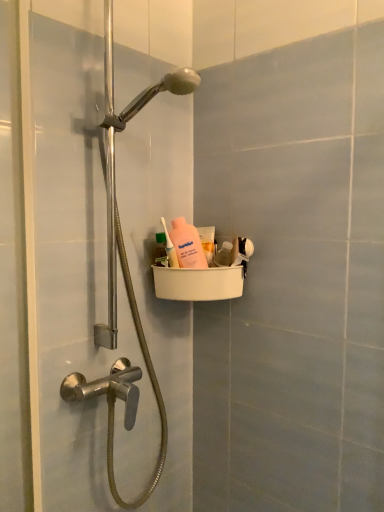
Find the location of a particular element. pink matte bottle at center, the second mouthwash from the left is located at coordinates 207,242.

Identify the location of white plastic basket at upper center. (58, 268).

This screenshot has width=384, height=512. Describe the element at coordinates (170, 248) in the screenshot. I see `pink matte bottle at upper center` at that location.

This screenshot has height=512, width=384. I want to click on pink matte bottle at center, acting as the second mouthwash starting from the front, so click(x=207, y=242).

Can you confirm if green plastic bottle at upper center, the 2th mouthwash in the right-to-left sequence, is positioned to the left of pink matte bottle at upper center?

Indeed, green plastic bottle at upper center, the 2th mouthwash in the right-to-left sequence, is positioned on the left side of pink matte bottle at upper center.

Is green plastic bottle at upper center, which is the 1th mouthwash in front-to-back order, positioned far away from pink matte bottle at upper center?

Actually, green plastic bottle at upper center, which is the 1th mouthwash in front-to-back order, and pink matte bottle at upper center are a little close together.

From the image's perspective, which mouthwash is the 1st one below the pink matte bottle at upper center? Please provide its 2D coordinates.

[(161, 249)]

Which object is closer to the camera taking this photo, green plastic bottle at upper center, the 2th mouthwash in the right-to-left sequence, or pink matte bottle at upper center?

pink matte bottle at upper center is closer to the camera.

Between point (176, 261) and point (133, 195), which one is positioned in front?

Point (133, 195)

Does pink matte bottle at upper center have a lesser height compared to white plastic basket at upper center?

Indeed, pink matte bottle at upper center has a lesser height compared to white plastic basket at upper center.

Is pink matte bottle at upper center aimed at white plastic basket at upper center?

Yes, pink matte bottle at upper center is turned towards white plastic basket at upper center.

Between pink matte bottle at upper center and white plastic basket at upper center, which one has smaller width?

pink matte bottle at upper center.

Considering the relative sizes of green plastic bottle at upper center, which is the 1th mouthwash in front-to-back order, and pink matte bottle at center, which is the first mouthwash in right-to-left order, in the image provided, is green plastic bottle at upper center, which is the 1th mouthwash in front-to-back order, taller than pink matte bottle at center, which is the first mouthwash in right-to-left order,?

No.

From a real-world perspective, who is located lower, green plastic bottle at upper center, which is the 2th mouthwash from back to front, or pink matte bottle at center, the second mouthwash from the left?

From a 3D spatial view, pink matte bottle at center, the second mouthwash from the left, is below.

From the picture: Is green plastic bottle at upper center, which is the 1th mouthwash in front-to-back order, looking in the opposite direction of pink matte bottle at center, which is the first mouthwash in right-to-left order?

No, pink matte bottle at center, which is the first mouthwash in right-to-left order, is not at the back of green plastic bottle at upper center, which is the 1th mouthwash in front-to-back order.

Is green plastic bottle at upper center, acting as the first mouthwash starting from the left, directly adjacent to pink matte bottle at center, the second mouthwash from the left?

There is a gap between green plastic bottle at upper center, acting as the first mouthwash starting from the left, and pink matte bottle at center, the second mouthwash from the left.

Is white plastic basket at upper center aimed at green plastic bottle at upper center, acting as the first mouthwash starting from the left?

Yes, white plastic basket at upper center is aimed at green plastic bottle at upper center, acting as the first mouthwash starting from the left.

Is white plastic basket at upper center shorter than green plastic bottle at upper center, the 2th mouthwash in the right-to-left sequence?

In fact, white plastic basket at upper center may be taller than green plastic bottle at upper center, the 2th mouthwash in the right-to-left sequence.

Measure the distance from white plastic basket at upper center to green plastic bottle at upper center, which is the 2th mouthwash from back to front.

white plastic basket at upper center is 42.00 centimeters from green plastic bottle at upper center, which is the 2th mouthwash from back to front.

Between white plastic basket at upper center and pink matte bottle at upper center, which one appears on the left side from the viewer's perspective?

From the viewer's perspective, white plastic basket at upper center appears more on the left side.

In order to click on screen door below the pink matte bottle at upper center (from the image's perspective) in this screenshot , I will do `click(58, 268)`.

Is white plastic basket at upper center positioned with its back to pink matte bottle at upper center?

Yes, pink matte bottle at upper center is at the back of white plastic basket at upper center.

Considering the relative sizes of pink matte bottle at upper center and green plastic bottle at upper center, which is the 1th mouthwash in front-to-back order, in the image provided, is pink matte bottle at upper center shorter than green plastic bottle at upper center, which is the 1th mouthwash in front-to-back order,?

In fact, pink matte bottle at upper center may be taller than green plastic bottle at upper center, which is the 1th mouthwash in front-to-back order.

Based on their positions, is pink matte bottle at upper center located to the left or right of green plastic bottle at upper center, which is the 1th mouthwash in front-to-back order?

From the image, it's evident that pink matte bottle at upper center is to the right of green plastic bottle at upper center, which is the 1th mouthwash in front-to-back order.

How different are the orientations of pink matte bottle at upper center and green plastic bottle at upper center, the 2th mouthwash in the right-to-left sequence, in degrees?

There is a 4.29-degree angle between the facing directions of pink matte bottle at upper center and green plastic bottle at upper center, the 2th mouthwash in the right-to-left sequence.

From the image's perspective, between pink matte bottle at upper center and green plastic bottle at upper center, acting as the first mouthwash starting from the left, which one is located above?

pink matte bottle at upper center, from the image's perspective.

From a real-world perspective, between pink matte bottle at center, the first mouthwash positioned from the back, and green plastic bottle at upper center, which is the 1th mouthwash in front-to-back order, who is vertically lower?

pink matte bottle at center, the first mouthwash positioned from the back, from a real-world perspective.

Is point (206, 255) closer to camera compared to point (160, 260)?

Yes, point (206, 255) is closer to viewer.

Which object is further away from the camera taking this photo, pink matte bottle at center, the second mouthwash from the left, or green plastic bottle at upper center, which is the 1th mouthwash in front-to-back order?

pink matte bottle at center, the second mouthwash from the left, is more distant.

Which is more to the right, pink matte bottle at center, the first mouthwash positioned from the back, or green plastic bottle at upper center, the 2th mouthwash in the right-to-left sequence?

pink matte bottle at center, the first mouthwash positioned from the back.

Where is `toiletry that appears in front of the green plastic bottle at upper center, which is the 2th mouthwash from back to front`? The height and width of the screenshot is (512, 384). toiletry that appears in front of the green plastic bottle at upper center, which is the 2th mouthwash from back to front is located at coordinates (170, 248).

This screenshot has height=512, width=384. I want to click on toiletry above the white plastic basket at upper center (from a real-world perspective), so click(170, 248).

In the scene shown: Based on their spatial positions, is pink matte bottle at upper center or white plastic basket at upper center closer to green plastic bottle at upper center, acting as the first mouthwash starting from the left?

pink matte bottle at upper center lies closer to green plastic bottle at upper center, acting as the first mouthwash starting from the left, than the other object.

Based on their spatial positions, is pink matte bottle at upper center or green plastic bottle at upper center, which is the 2th mouthwash from back to front, closer to white plastic basket at upper center?

pink matte bottle at upper center is closer to white plastic basket at upper center.

Based on their spatial positions, is white plastic basket at upper center or pink matte bottle at center, the first mouthwash positioned from the back, further from green plastic bottle at upper center, which is the 1th mouthwash in front-to-back order?

white plastic basket at upper center is further to green plastic bottle at upper center, which is the 1th mouthwash in front-to-back order.

When comparing their distances from green plastic bottle at upper center, acting as the first mouthwash starting from the left, does white plastic basket at upper center or pink matte bottle at upper center seem further?

Among the two, white plastic basket at upper center is located further to green plastic bottle at upper center, acting as the first mouthwash starting from the left.

When comparing their distances from pink matte bottle at upper center, does green plastic bottle at upper center, which is the 2th mouthwash from back to front, or pink matte bottle at center, the first mouthwash positioned from the back, seem further?

pink matte bottle at center, the first mouthwash positioned from the back.

Looking at the image, which one is located further to green plastic bottle at upper center, which is the 2th mouthwash from back to front, pink matte bottle at center, which is the first mouthwash in right-to-left order, or white plastic basket at upper center?

Based on the image, white plastic basket at upper center appears to be further to green plastic bottle at upper center, which is the 2th mouthwash from back to front.

Estimate the real-world distances between objects in this image. Which object is closer to white plastic basket at upper center, pink matte bottle at center, acting as the second mouthwash starting from the front, or pink matte bottle at upper center?

Among the two, pink matte bottle at upper center is located nearer to white plastic basket at upper center.

In the scene shown: Based on their spatial positions, is green plastic bottle at upper center, the 2th mouthwash in the right-to-left sequence, or white plastic basket at upper center further from pink matte bottle at center, the first mouthwash positioned from the back?

white plastic basket at upper center.

This screenshot has height=512, width=384. Find the location of `mouthwash between white plastic basket at upper center and pink matte bottle at center, acting as the second mouthwash starting from the front, in the front-back direction`. mouthwash between white plastic basket at upper center and pink matte bottle at center, acting as the second mouthwash starting from the front, in the front-back direction is located at coordinates (161, 249).

At what (x,y) coordinates should I click in order to perform the action: click on toiletry between white plastic basket at upper center and pink matte bottle at center, the first mouthwash positioned from the back, along the z-axis. Please return your answer as a coordinate pair (x, y). The width and height of the screenshot is (384, 512). Looking at the image, I should click on pos(170,248).

I want to click on toiletry between white plastic basket at upper center and green plastic bottle at upper center, which is the 2th mouthwash from back to front, from front to back, so click(170, 248).

The height and width of the screenshot is (512, 384). Identify the location of toiletry located between green plastic bottle at upper center, which is the 1th mouthwash in front-to-back order, and pink matte bottle at center, the second mouthwash from the left, in the left-right direction. (170, 248).